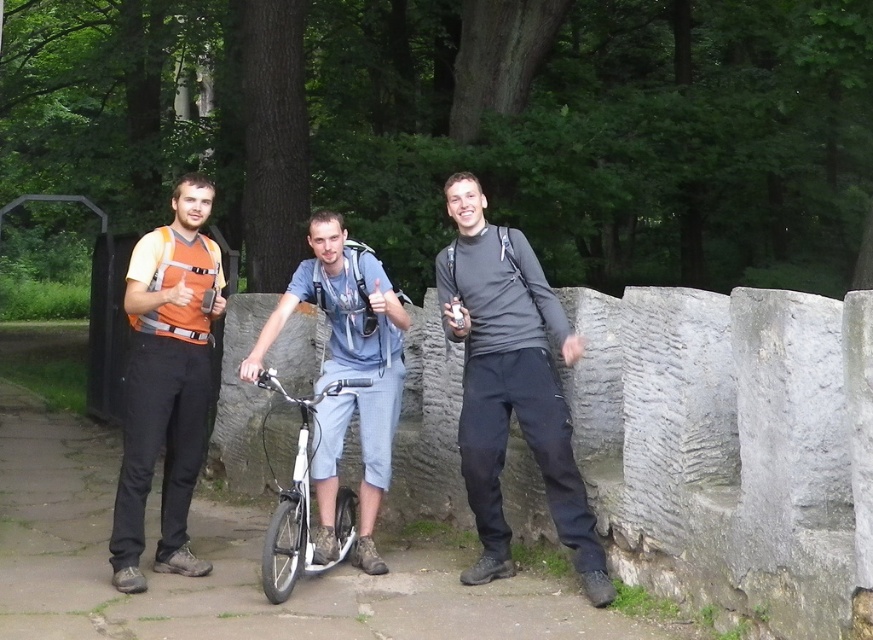
Question: Which point is closer to the camera?

Choices:
 (A) denim shorts at center
 (B) white matte bicycle at center

Answer: (B)

Question: Can you confirm if dark gray matte pants at center is positioned to the right of denim shorts at center?

Choices:
 (A) yes
 (B) no

Answer: (A)

Question: Which of the following is the closest to the observer?

Choices:
 (A) (306, 460)
 (B) (475, 444)
 (C) (355, 259)

Answer: (B)

Question: Among these points, which one is farthest from the camera?

Choices:
 (A) (277, 586)
 (B) (528, 440)

Answer: (B)

Question: Is dark gray matte pants at center smaller than matte orange shirt at left?

Choices:
 (A) no
 (B) yes

Answer: (A)

Question: Does denim shorts at center come in front of white matte bicycle at center?

Choices:
 (A) no
 (B) yes

Answer: (A)